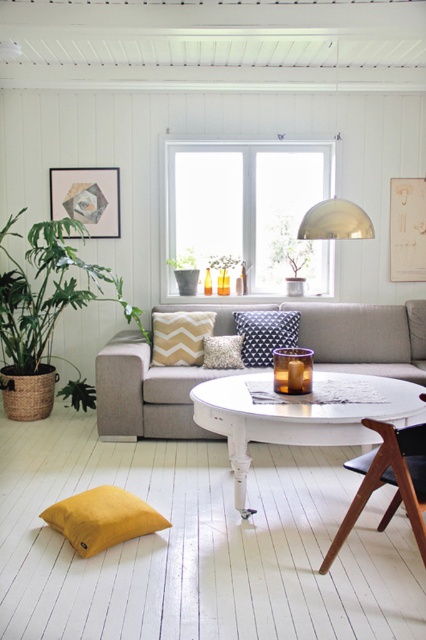
You are sitting on the gray sofa and want to reach both the green leafy plant in woven pot at left and the mustard yellow cushion at lower left. Which object is closer to your right side?

The mustard yellow cushion at lower left is closer to your right side because the green leafy plant in woven pot at left is to the left of it.

You are standing in the living room and want to place a new teak wood chair at center. According to the image, where should you place it?

You should place the teak wood chair at center at the coordinates point (388, 481).

You are sitting on the teak wood chair at center and want to reach the navy blue textured pillow at center. Which direction should you move to get closer to the pillow?

The teak wood chair at center is in front of the navy blue textured pillow at center, so you should move backward to get closer to the pillow.